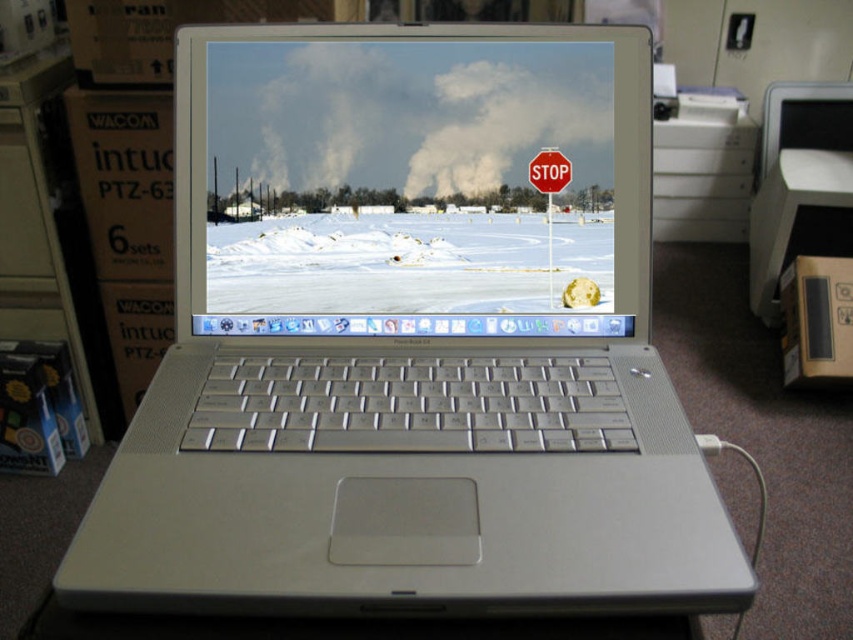
Who is more forward, (219,200) or (541,150)?

Point (541,150)

Does point (465, 84) come behind point (549, 195)?

That is False.

The width and height of the screenshot is (853, 640). In order to click on matte plastic screen at center in this screenshot , I will do `click(398, 186)`.

At what (x,y) coordinates should I click in order to perform the action: click on matte plastic screen at center. Please return your answer as a coordinate pair (x, y). Looking at the image, I should click on (398, 186).